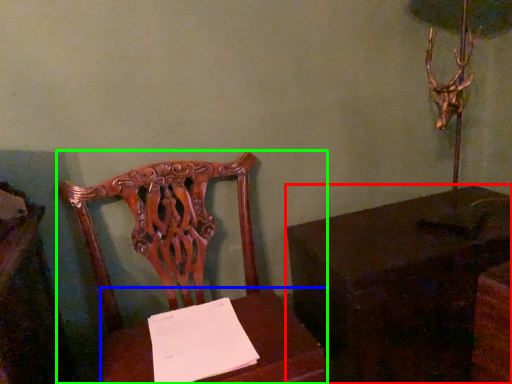
Question: Which object is the farthest from table (highlighted by a red box)? Choose among these: table (highlighted by a blue box) or chair (highlighted by a green box).

Choices:
 (A) table
 (B) chair

Answer: (B)